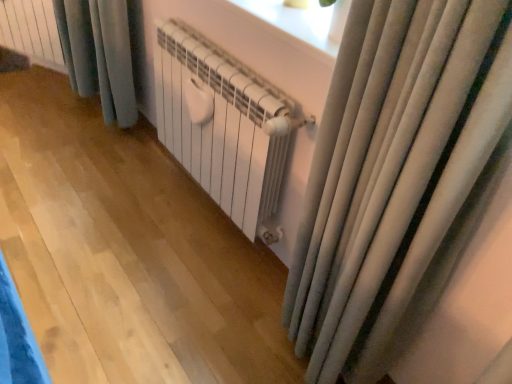
What is the approximate height of white matte radiator at center, positioned as the first radiator in bottom-to-top order?

The height of white matte radiator at center, positioned as the first radiator in bottom-to-top order, is 23.47 inches.

The width and height of the screenshot is (512, 384). Describe the element at coordinates (223, 125) in the screenshot. I see `white matte radiator at center, positioned as the first radiator in bottom-to-top order` at that location.

Where is `white matte radiator at center, arranged as the 1th radiator when viewed from the right`? white matte radiator at center, arranged as the 1th radiator when viewed from the right is located at coordinates (223, 125).

This screenshot has width=512, height=384. What are the coordinates of `white matte radiator at upper left, positioned as the first radiator in back-to-front order` in the screenshot? It's located at (32, 31).

This screenshot has height=384, width=512. Describe the element at coordinates (32, 31) in the screenshot. I see `white matte radiator at upper left, placed as the 2th radiator when sorted from bottom to top` at that location.

In order to click on white matte radiator at center, placed as the 2th radiator when sorted from back to front in this screenshot , I will do `click(223, 125)`.

Is white matte radiator at upper left, positioned as the 1th radiator in left-to-right order, to the left or to the right of white matte radiator at center, arranged as the 1th radiator when viewed from the right, in the image?

white matte radiator at upper left, positioned as the 1th radiator in left-to-right order, is positioned on white matte radiator at center, arranged as the 1th radiator when viewed from the right,'s left side.

Is white matte radiator at upper left, placed as the 2th radiator when sorted from bottom to top, closer to the viewer compared to white matte radiator at center, placed as the 2th radiator when sorted from back to front?

No, it is behind white matte radiator at center, placed as the 2th radiator when sorted from back to front.

Is point (53, 64) positioned after point (247, 90)?

Yes, point (53, 64) is behind point (247, 90).

Looking at this image, from the image's perspective, which one is positioned lower, white matte radiator at upper left, which is the second radiator in right-to-left order, or white matte radiator at center, positioned as the first radiator in bottom-to-top order?

white matte radiator at center, positioned as the first radiator in bottom-to-top order, from the image's perspective.

From a real-world perspective, who is located lower, white matte radiator at upper left, positioned as the 1th radiator in top-to-bottom order, or white matte radiator at center, which ranks as the 2th radiator in top-to-bottom order?

From a 3D spatial view, white matte radiator at upper left, positioned as the 1th radiator in top-to-bottom order, is below.

Is white matte radiator at upper left, placed as the 2th radiator when sorted from bottom to top, thinner than white matte radiator at center, placed as the 2th radiator when sorted from back to front?

Yes.

Considering the sizes of objects white matte radiator at upper left, positioned as the 1th radiator in top-to-bottom order, and white matte radiator at center, which appears as the 2th radiator when viewed from the left, in the image provided, who is shorter, white matte radiator at upper left, positioned as the 1th radiator in top-to-bottom order, or white matte radiator at center, which appears as the 2th radiator when viewed from the left,?

Standing shorter between the two is white matte radiator at upper left, positioned as the 1th radiator in top-to-bottom order.

Considering the relative sizes of white matte radiator at upper left, positioned as the 1th radiator in top-to-bottom order, and white matte radiator at center, arranged as the 1th radiator when viewed from the right, in the image provided, is white matte radiator at upper left, positioned as the 1th radiator in top-to-bottom order, bigger than white matte radiator at center, arranged as the 1th radiator when viewed from the right,?

No.

Is white matte radiator at upper left, positioned as the 1th radiator in left-to-right order, outside of white matte radiator at center, placed as the 2th radiator when sorted from back to front?

white matte radiator at upper left, positioned as the 1th radiator in left-to-right order, lies outside white matte radiator at center, placed as the 2th radiator when sorted from back to front,'s area.

Is white matte radiator at upper left, positioned as the 1th radiator in top-to-bottom order, next to white matte radiator at center, which appears as the 2th radiator when viewed from the left?

No, white matte radiator at upper left, positioned as the 1th radiator in top-to-bottom order, is not next to white matte radiator at center, which appears as the 2th radiator when viewed from the left.

Is white matte radiator at upper left, positioned as the first radiator in back-to-front order, turned away from white matte radiator at center, which appears as the 2th radiator when viewed from the left?

No, white matte radiator at upper left, positioned as the first radiator in back-to-front order,'s orientation is not away from white matte radiator at center, which appears as the 2th radiator when viewed from the left.

How many degrees apart are the facing directions of white matte radiator at upper left, positioned as the 1th radiator in top-to-bottom order, and white matte radiator at center, which ranks as the 2th radiator in top-to-bottom order?

white matte radiator at upper left, positioned as the 1th radiator in top-to-bottom order, and white matte radiator at center, which ranks as the 2th radiator in top-to-bottom order, are facing 28.3 degrees away from each other.

This screenshot has height=384, width=512. Identify the location of radiator below the white matte radiator at upper left, placed as the 2th radiator when sorted from bottom to top (from the image's perspective). (223, 125).

Consider the image. Does white matte radiator at center, placed as the 2th radiator when sorted from back to front, appear on the left side of white matte radiator at upper left, placed as the 2th radiator when sorted from bottom to top?

No, white matte radiator at center, placed as the 2th radiator when sorted from back to front, is not to the left of white matte radiator at upper left, placed as the 2th radiator when sorted from bottom to top.

In the image, is white matte radiator at center, marked as the first radiator in a front-to-back arrangement, positioned in front of or behind white matte radiator at upper left, which is the 2th radiator from front to back?

white matte radiator at center, marked as the first radiator in a front-to-back arrangement, is in front of white matte radiator at upper left, which is the 2th radiator from front to back.

Considering the positions of point (221, 204) and point (27, 11), is point (221, 204) closer or farther from the camera than point (27, 11)?

Point (221, 204) is closer to the camera than point (27, 11).

From the image's perspective, between white matte radiator at center, positioned as the first radiator in bottom-to-top order, and white matte radiator at upper left, which is the second radiator in right-to-left order, which one is located above?

white matte radiator at upper left, which is the second radiator in right-to-left order.

From a real-world perspective, is white matte radiator at center, arranged as the 1th radiator when viewed from the right, below white matte radiator at upper left, placed as the 2th radiator when sorted from bottom to top?

No, from a real-world perspective, white matte radiator at center, arranged as the 1th radiator when viewed from the right, is not under white matte radiator at upper left, placed as the 2th radiator when sorted from bottom to top.

Considering the sizes of white matte radiator at center, which appears as the 2th radiator when viewed from the left, and white matte radiator at upper left, positioned as the 1th radiator in top-to-bottom order, in the image, is white matte radiator at center, which appears as the 2th radiator when viewed from the left, wider or thinner than white matte radiator at upper left, positioned as the 1th radiator in top-to-bottom order,?

white matte radiator at center, which appears as the 2th radiator when viewed from the left, is wider than white matte radiator at upper left, positioned as the 1th radiator in top-to-bottom order.

Who is taller, white matte radiator at center, which appears as the 2th radiator when viewed from the left, or white matte radiator at upper left, positioned as the first radiator in back-to-front order?

white matte radiator at center, which appears as the 2th radiator when viewed from the left, is taller.

Can you confirm if white matte radiator at center, positioned as the first radiator in bottom-to-top order, is smaller than white matte radiator at upper left, placed as the 2th radiator when sorted from bottom to top?

No.

Can white matte radiator at upper left, placed as the 2th radiator when sorted from bottom to top, be found inside white matte radiator at center, which ranks as the 2th radiator in top-to-bottom order?

Definitely not — white matte radiator at upper left, placed as the 2th radiator when sorted from bottom to top, is not inside white matte radiator at center, which ranks as the 2th radiator in top-to-bottom order.

Can you see white matte radiator at center, arranged as the 1th radiator when viewed from the right, touching white matte radiator at upper left, which is the second radiator in right-to-left order?

No, white matte radiator at center, arranged as the 1th radiator when viewed from the right, is not next to white matte radiator at upper left, which is the second radiator in right-to-left order.

Is white matte radiator at upper left, placed as the 2th radiator when sorted from bottom to top, at the back of white matte radiator at center, placed as the 2th radiator when sorted from back to front?

No, white matte radiator at upper left, placed as the 2th radiator when sorted from bottom to top, is not at the back of white matte radiator at center, placed as the 2th radiator when sorted from back to front.

What's the angular difference between white matte radiator at center, arranged as the 1th radiator when viewed from the right, and white matte radiator at upper left, positioned as the 1th radiator in top-to-bottom order,'s facing directions?

They differ by 28.3 degrees in their facing directions.

Find the location of a particular element. This screenshot has width=512, height=384. radiator located on the right of white matte radiator at upper left, positioned as the first radiator in back-to-front order is located at coordinates (223, 125).

Identify the location of radiator in front of the white matte radiator at upper left, which is the second radiator in right-to-left order. (223, 125).

Where is `radiator below the white matte radiator at center, arranged as the 1th radiator when viewed from the right (from a real-world perspective)`? radiator below the white matte radiator at center, arranged as the 1th radiator when viewed from the right (from a real-world perspective) is located at coordinates (32, 31).